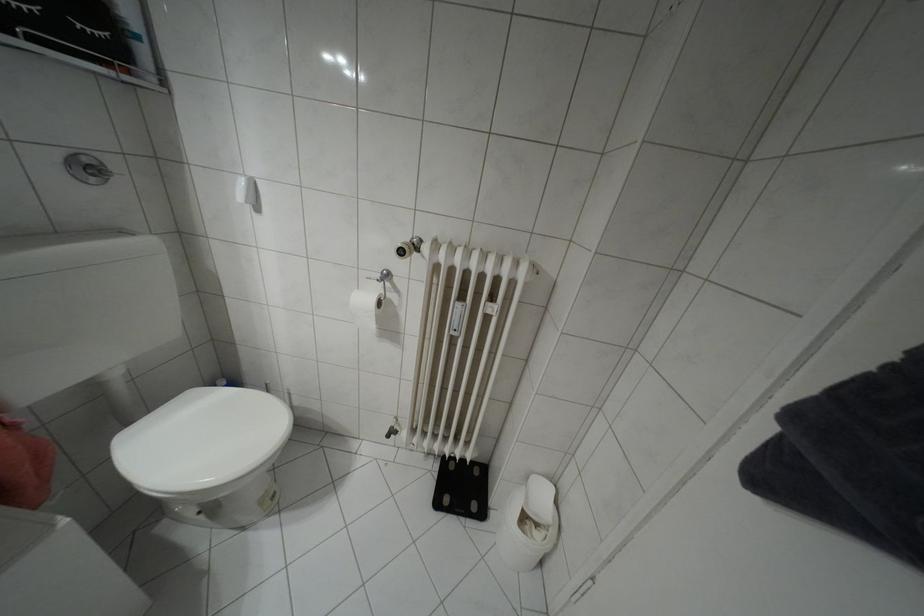
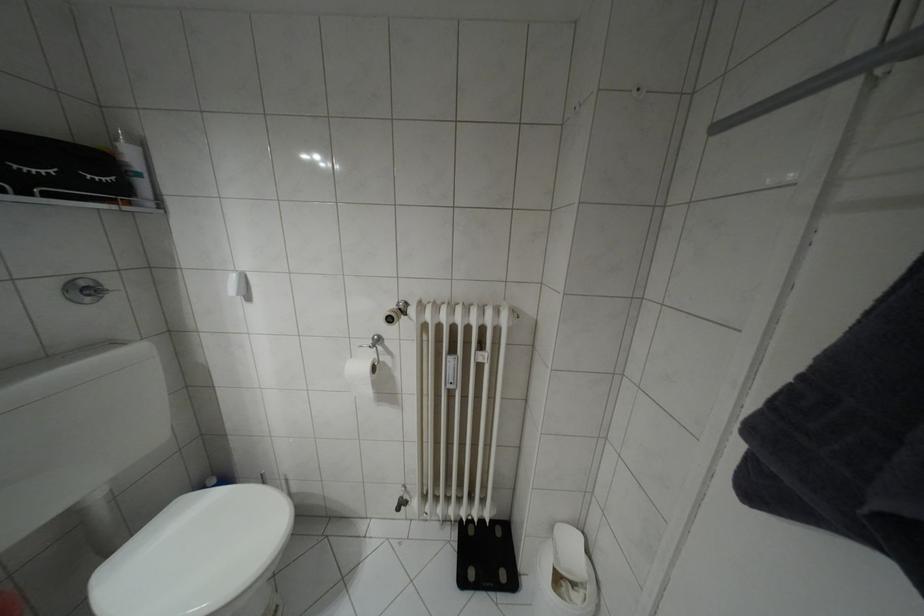
Locate, in the second image, the point that corresponds to pixel 371 325 in the first image.

(369, 392)